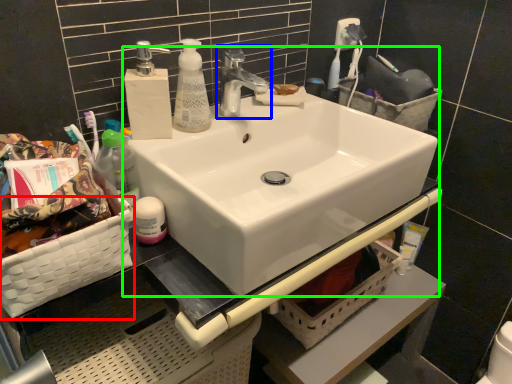
Question: Which is nearer to the basket (highlighted by a red box)? tap (highlighted by a blue box) or sink (highlighted by a green box).

Choices:
 (A) tap
 (B) sink

Answer: (B)